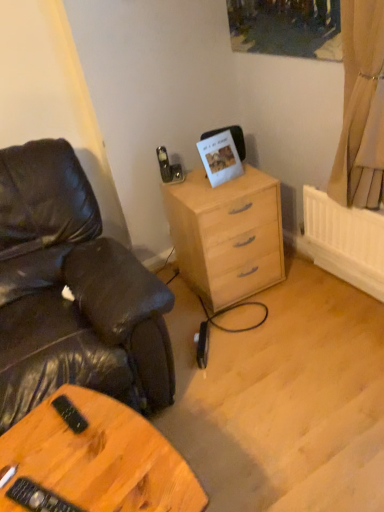
Question: Is black leather chair at left next to beige fabric curtain at upper right and touching it?

Choices:
 (A) yes
 (B) no

Answer: (B)

Question: From the image's perspective, does black leather chair at left appear higher than beige fabric curtain at upper right?

Choices:
 (A) no
 (B) yes

Answer: (A)

Question: Is the position of black leather chair at left less distant than that of beige fabric curtain at upper right?

Choices:
 (A) no
 (B) yes

Answer: (B)

Question: Is there a large distance between black leather chair at left and beige fabric curtain at upper right?

Choices:
 (A) yes
 (B) no

Answer: (A)

Question: Does black leather chair at left have a lesser width compared to beige fabric curtain at upper right?

Choices:
 (A) yes
 (B) no

Answer: (B)

Question: From their relative heights in the image, would you say light wood/finish chest of drawers at center is taller or shorter than wooden table at lower left?

Choices:
 (A) tall
 (B) short

Answer: (A)

Question: Is light wood/finish chest of drawers at center inside the boundaries of wooden table at lower left, or outside?

Choices:
 (A) outside
 (B) inside

Answer: (A)

Question: From the image's perspective, is light wood/finish chest of drawers at center located above or below wooden table at lower left?

Choices:
 (A) above
 (B) below

Answer: (A)

Question: In the image, is light wood/finish chest of drawers at center positioned in front of or behind wooden table at lower left?

Choices:
 (A) behind
 (B) front

Answer: (A)

Question: Visually, is beige fabric curtain at upper right positioned to the left or to the right of wooden table at lower left?

Choices:
 (A) left
 (B) right

Answer: (B)

Question: Is beige fabric curtain at upper right in front of or behind wooden table at lower left in the image?

Choices:
 (A) behind
 (B) front

Answer: (A)

Question: Is point (370, 157) positioned closer to the camera than point (28, 509)?

Choices:
 (A) closer
 (B) farther

Answer: (B)

Question: Is beige fabric curtain at upper right taller or shorter than wooden table at lower left?

Choices:
 (A) tall
 (B) short

Answer: (A)

Question: From the image's perspective, is black leather chair at left above or below wooden table at lower left?

Choices:
 (A) below
 (B) above

Answer: (B)

Question: Is black leather chair at left wider or thinner than wooden table at lower left?

Choices:
 (A) wide
 (B) thin

Answer: (A)